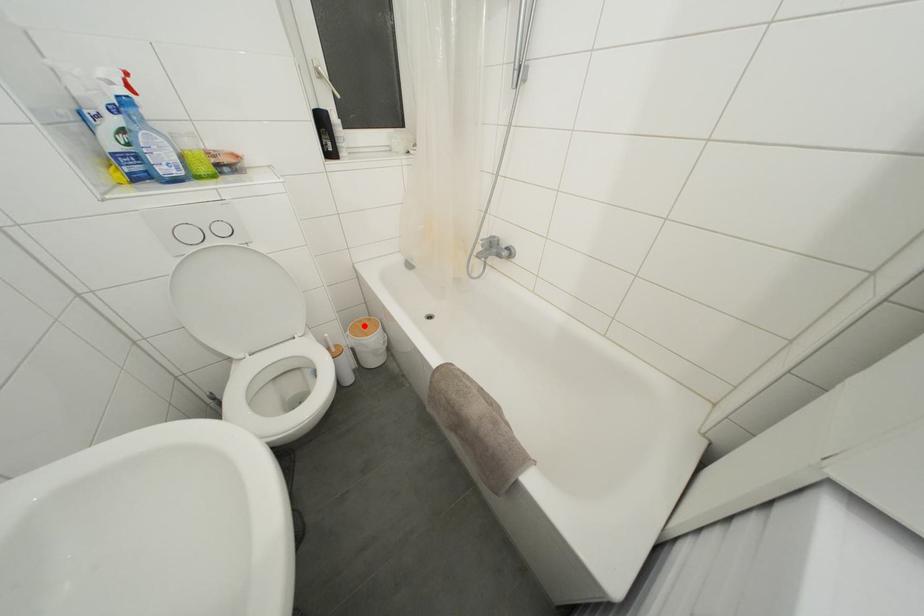
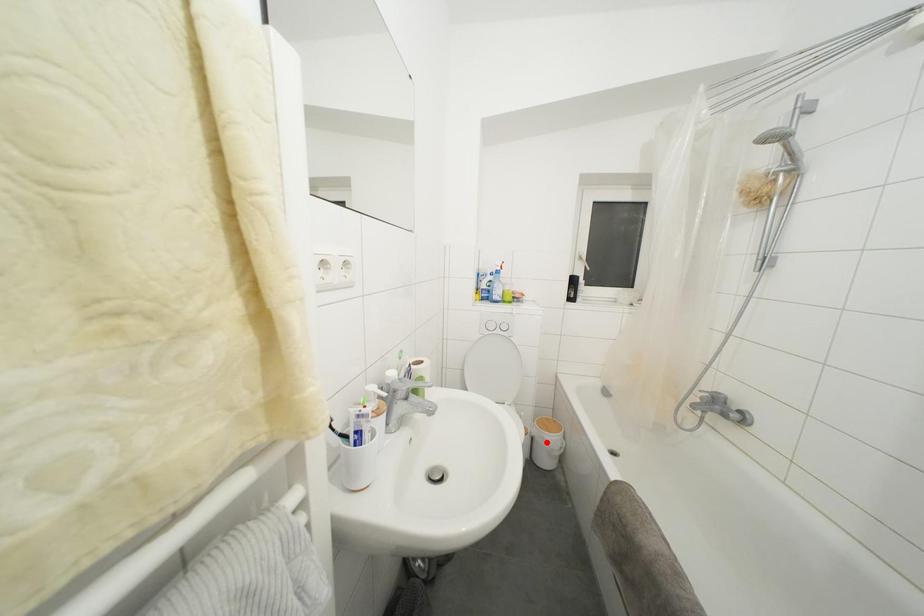
I am providing you with two images of the same scene from different viewpoints. A red point is marked on the first image and another point is marked on the second image. Are the points marked in image1 and image2 representing the same 3D position?

No